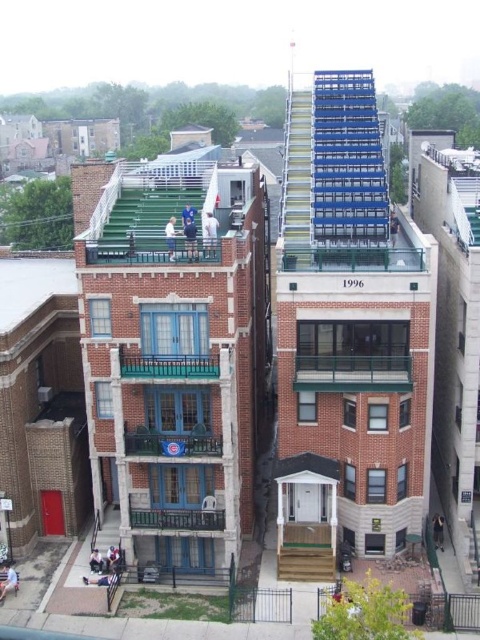
Who is taller, blue painted wood balcony at center or teal wrought iron balcony at center?

teal wrought iron balcony at center is taller.

Is blue painted wood balcony at center in front of teal wrought iron balcony at center?

No, blue painted wood balcony at center is further to the viewer.

Is point (147, 440) farther from camera compared to point (207, 368)?

Yes, point (147, 440) is behind point (207, 368).

This screenshot has height=640, width=480. What are the coordinates of `blue painted wood balcony at center` in the screenshot? It's located at (172, 442).

Can you confirm if green glass balcony at center is positioned below green painted wood balcony at lower center?

Actually, green glass balcony at center is above green painted wood balcony at lower center.

Can you confirm if green glass balcony at center is positioned above green painted wood balcony at lower center?

Indeed, green glass balcony at center is positioned over green painted wood balcony at lower center.

Where is `green glass balcony at center`? The height and width of the screenshot is (640, 480). green glass balcony at center is located at coordinates (352, 372).

The height and width of the screenshot is (640, 480). What are the coordinates of `green glass balcony at center` in the screenshot? It's located at (352, 372).

From the picture: Can you confirm if teal wrought iron balcony at center is bigger than green painted wood balcony at lower center?

Correct, teal wrought iron balcony at center is larger in size than green painted wood balcony at lower center.

Is point (218, 365) positioned behind point (144, 528)?

No.

Image resolution: width=480 pixels, height=640 pixels. What are the coordinates of `teal wrought iron balcony at center` in the screenshot? It's located at (168, 364).